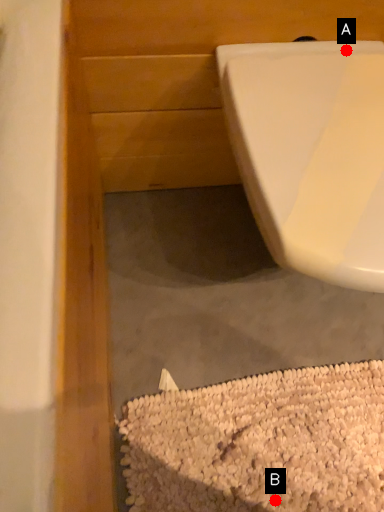
Question: Two points are circled on the image, labeled by A and B beside each circle. Among these points, which one is farthest from the camera?

Choices:
 (A) A is further
 (B) B is further

Answer: (B)